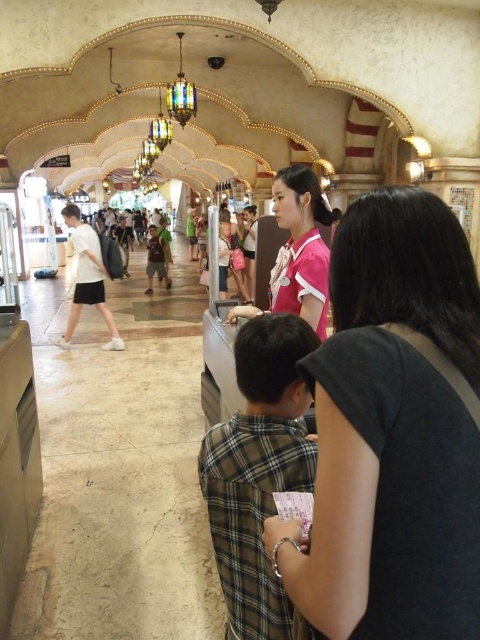
Question: From the image, what is the correct spatial relationship of pink fabric shirt at center in relation to green fabric shirt at center?

Choices:
 (A) left
 (B) right

Answer: (B)

Question: Among these points, which one is farthest from the camera?

Choices:
 (A) (322, 570)
 (B) (63, 216)

Answer: (B)

Question: Does pink jersey at center appear on the left side of white matte shirt at center?

Choices:
 (A) yes
 (B) no

Answer: (B)

Question: Which object is the farthest from the green fabric shirt at center?

Choices:
 (A) pink fabric shirt at center
 (B) pink jersey at center
 (C) white matte shirt at center

Answer: (A)

Question: Which of the following is the farthest from the observer?

Choices:
 (A) (312, 301)
 (B) (330, 593)
 (C) (153, 250)
 (D) (83, 289)

Answer: (C)

Question: Can you confirm if pink fabric shirt at center is positioned above white matte shirt at center?

Choices:
 (A) no
 (B) yes

Answer: (A)